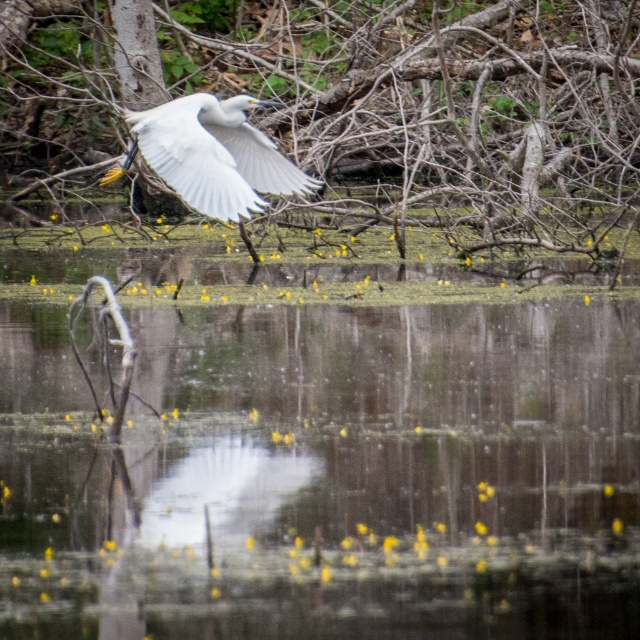
Find the location of a particular element. smooth bark tree at upper center is located at coordinates (419, 108).

Between smooth bark tree at upper center and white feathered bird at center, which one appears on the left side from the viewer's perspective?

Positioned to the left is white feathered bird at center.

Measure the distance between point (44, 112) and camera.

Point (44, 112) and camera are 20.13 meters apart from each other.

Image resolution: width=640 pixels, height=640 pixels. Identify the location of smooth bark tree at upper center. (419, 108).